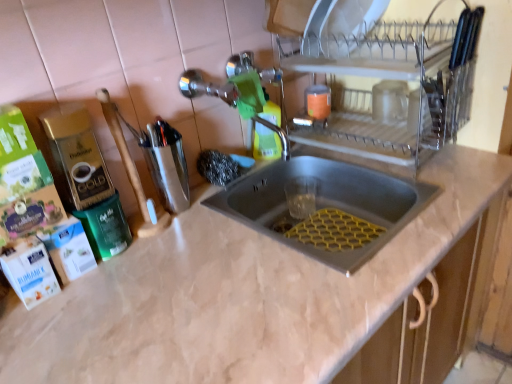
Question: From the image's perspective, is stainless steel sink at center under metallic silver utensil holder at center-left, acting as the second appliance starting from the right?

Choices:
 (A) no
 (B) yes

Answer: (B)

Question: Considering the relative sizes of stainless steel sink at center and metallic silver utensil holder at center-left, acting as the second appliance starting from the right, in the image provided, is stainless steel sink at center taller than metallic silver utensil holder at center-left, acting as the second appliance starting from the right,?

Choices:
 (A) yes
 (B) no

Answer: (B)

Question: Is stainless steel sink at center at the left side of metallic silver utensil holder at center-left, acting as the second appliance starting from the right?

Choices:
 (A) yes
 (B) no

Answer: (B)

Question: Can you confirm if stainless steel sink at center is smaller than metallic silver utensil holder at center-left, acting as the second appliance starting from the right?

Choices:
 (A) yes
 (B) no

Answer: (B)

Question: From a real-world perspective, is stainless steel sink at center beneath metallic silver utensil holder at center-left, acting as the second appliance starting from the right?

Choices:
 (A) no
 (B) yes

Answer: (B)

Question: In the image, is stainless steel sink at center on the left side or the right side of clear glass dish rack at upper right, which is the 2th appliance from left to right?

Choices:
 (A) right
 (B) left

Answer: (B)

Question: Does point (322, 190) appear closer or farther from the camera than point (422, 153)?

Choices:
 (A) farther
 (B) closer

Answer: (A)

Question: Is stainless steel sink at center wider or thinner than clear glass dish rack at upper right, the first appliance viewed from the right?

Choices:
 (A) thin
 (B) wide

Answer: (B)

Question: From the image's perspective, relative to clear glass dish rack at upper right, the first appliance viewed from the right, is stainless steel sink at center above or below?

Choices:
 (A) below
 (B) above

Answer: (A)

Question: Is beige marble countertop at center wider or thinner than clear glass dish rack at upper right, the first appliance viewed from the right?

Choices:
 (A) wide
 (B) thin

Answer: (A)

Question: From the image's perspective, relative to clear glass dish rack at upper right, the first appliance viewed from the right, is beige marble countertop at center above or below?

Choices:
 (A) above
 (B) below

Answer: (B)

Question: From their relative heights in the image, would you say beige marble countertop at center is taller or shorter than clear glass dish rack at upper right, the first appliance viewed from the right?

Choices:
 (A) tall
 (B) short

Answer: (A)

Question: Considering the positions of beige marble countertop at center and clear glass dish rack at upper right, the first appliance viewed from the right, in the image, is beige marble countertop at center bigger or smaller than clear glass dish rack at upper right, the first appliance viewed from the right,?

Choices:
 (A) small
 (B) big

Answer: (B)

Question: Visually, is beige marble countertop at center positioned to the left or to the right of stainless steel sink at center?

Choices:
 (A) right
 (B) left

Answer: (A)

Question: Is point (378, 299) closer or farther from the camera than point (334, 178)?

Choices:
 (A) farther
 (B) closer

Answer: (B)